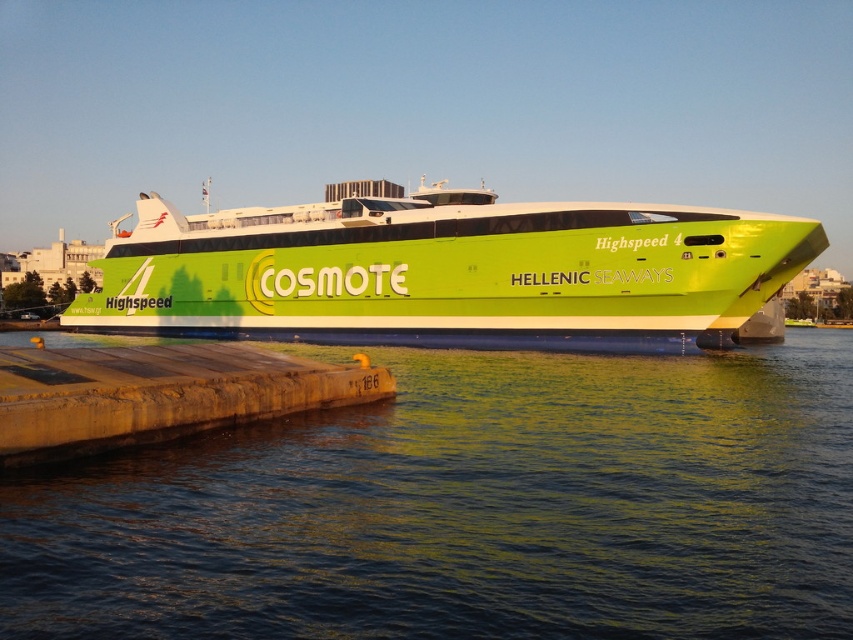
Question: Which of the following is the closest to the observer?

Choices:
 (A) (32, 561)
 (B) (456, 193)

Answer: (A)

Question: Can you confirm if green reflective water at lower center is positioned below wooden dock at lower left?

Choices:
 (A) no
 (B) yes

Answer: (B)

Question: Based on their relative distances, which object is nearer to the green reflective water at lower center?

Choices:
 (A) wooden dock at lower left
 (B) green matte/clear glass ferry at center

Answer: (A)

Question: Can you confirm if green reflective water at lower center is positioned to the right of wooden dock at lower left?

Choices:
 (A) yes
 (B) no

Answer: (A)

Question: Can you confirm if green reflective water at lower center is positioned above green matte/clear glass ferry at center?

Choices:
 (A) yes
 (B) no

Answer: (B)

Question: Estimate the real-world distances between objects in this image. Which object is farther from the green reflective water at lower center?

Choices:
 (A) green matte/clear glass ferry at center
 (B) wooden dock at lower left

Answer: (A)